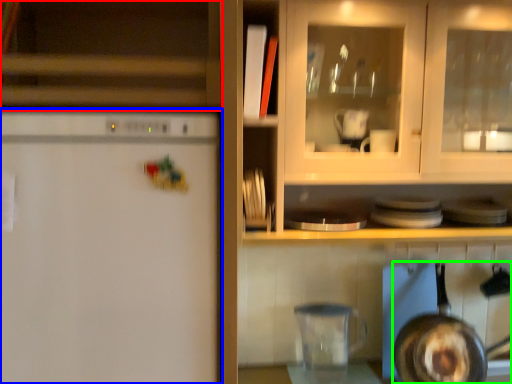
Question: Which is nearer to the cabinetry (highlighted by a red box)? refrigerator (highlighted by a blue box) or frying pan (highlighted by a green box).

Choices:
 (A) refrigerator
 (B) frying pan

Answer: (A)